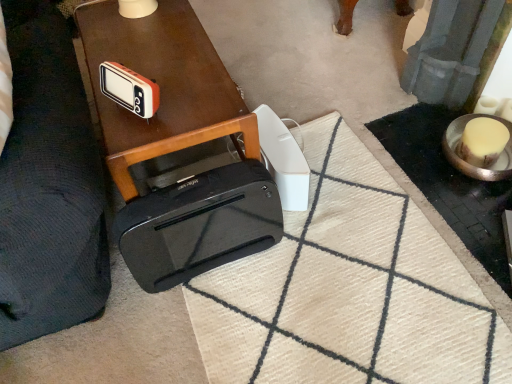
Identify the location of blank space above white plastic remote control at center, which is the 2th gadget from left to right (from a real-world perspective). This screenshot has height=384, width=512. (281, 154).